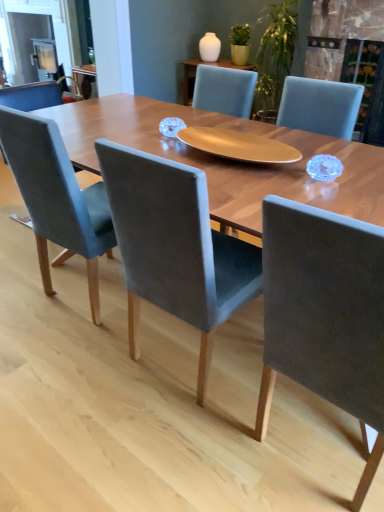
Locate an element on the screen. The width and height of the screenshot is (384, 512). vacant space situated on the left part of velvet grey chair at center, marked as the second chair in a left-to-right arrangement is located at coordinates (89, 371).